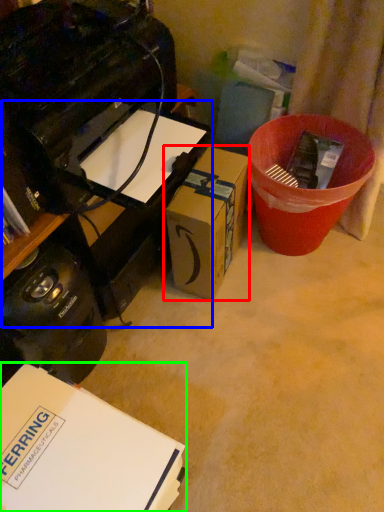
Question: Which object is positioned closest to box (highlighted by a red box)? Select from computer desk (highlighted by a blue box) and box (highlighted by a green box).

Choices:
 (A) computer desk
 (B) box

Answer: (A)